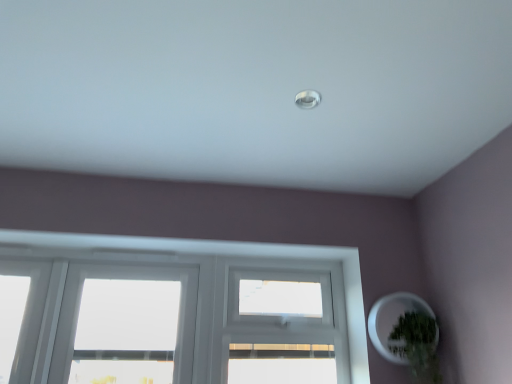
I want to click on white matte plant pot at lower right, so click(x=393, y=322).

What is the approximate width of white matte plant pot at lower right?

white matte plant pot at lower right is 10.65 centimeters in width.

What do you see at coordinates (393, 322) in the screenshot?
I see `white matte plant pot at lower right` at bounding box center [393, 322].

What do you see at coordinates (417, 345) in the screenshot?
I see `green matte plant at lower right` at bounding box center [417, 345].

In the scene shown: Measure the distance between green matte plant at lower right and camera.

green matte plant at lower right is 1.87 meters from camera.

Identify the location of green matte plant at lower right. The image size is (512, 384). (417, 345).

In order to click on white matte plant pot at lower right in this screenshot , I will do `click(393, 322)`.

Between white matte plant pot at lower right and green matte plant at lower right, which one appears on the right side from the viewer's perspective?

Positioned to the right is green matte plant at lower right.

Which object is more forward, white matte plant pot at lower right or green matte plant at lower right?

green matte plant at lower right.

In the scene shown: Which is nearer, (376,311) or (401,355)?

Point (376,311).

From the image's perspective, is white matte plant pot at lower right above or below green matte plant at lower right?

Clearly, from the image's perspective, white matte plant pot at lower right is above green matte plant at lower right.

From a real-world perspective, is white matte plant pot at lower right over green matte plant at lower right?

Indeed, from a real-world perspective, white matte plant pot at lower right stands above green matte plant at lower right.

Is white matte plant pot at lower right wider or thinner than green matte plant at lower right?

In the image, white matte plant pot at lower right appears to be more narrow than green matte plant at lower right.

Which of these two, white matte plant pot at lower right or green matte plant at lower right, stands shorter?

Standing shorter between the two is white matte plant pot at lower right.

Considering the relative sizes of white matte plant pot at lower right and green matte plant at lower right in the image provided, is white matte plant pot at lower right smaller than green matte plant at lower right?

Incorrect, white matte plant pot at lower right is not smaller in size than green matte plant at lower right.

Which is correct: white matte plant pot at lower right is inside green matte plant at lower right, or outside of it?

white matte plant pot at lower right is enclosed within green matte plant at lower right.

Is white matte plant pot at lower right beside green matte plant at lower right?

Yes, the surface of white matte plant pot at lower right is in contact with green matte plant at lower right.

Is green matte plant at lower right at the back of white matte plant pot at lower right?

Yes, white matte plant pot at lower right is facing away from green matte plant at lower right.

Can you tell me how much white matte plant pot at lower right and green matte plant at lower right differ in facing direction?

The facing directions of white matte plant pot at lower right and green matte plant at lower right are 0.000546 degrees apart.

The height and width of the screenshot is (384, 512). I want to click on houseplant on the right of white matte plant pot at lower right, so click(417, 345).

Considering the positions of objects green matte plant at lower right and white matte plant pot at lower right in the image provided, who is more to the left, green matte plant at lower right or white matte plant pot at lower right?

From the viewer's perspective, white matte plant pot at lower right appears more on the left side.

Consider the image. Relative to white matte plant pot at lower right, is green matte plant at lower right in front or behind?

green matte plant at lower right is positioned closer to the viewer than white matte plant pot at lower right.

Does point (422, 344) appear closer or farther from the camera than point (437, 345)?

Point (422, 344) appears to be closer to the viewer than point (437, 345).

From the image's perspective, which object appears higher, green matte plant at lower right or white matte plant pot at lower right?

white matte plant pot at lower right, from the image's perspective.

From a real-world perspective, is green matte plant at lower right beneath white matte plant pot at lower right?

Yes.

Considering the relative sizes of green matte plant at lower right and white matte plant pot at lower right in the image provided, is green matte plant at lower right thinner than white matte plant pot at lower right?

Incorrect, the width of green matte plant at lower right is not less than that of white matte plant pot at lower right.

Who is taller, green matte plant at lower right or white matte plant pot at lower right?

Standing taller between the two is green matte plant at lower right.

Looking at the image, does green matte plant at lower right seem bigger or smaller compared to white matte plant pot at lower right?

Clearly, green matte plant at lower right is smaller in size than white matte plant pot at lower right.

Is green matte plant at lower right positioned beyond the bounds of white matte plant pot at lower right?

No, green matte plant at lower right is inside white matte plant pot at lower right's boundary.

Is green matte plant at lower right far from white matte plant pot at lower right?

No.

Is white matte plant pot at lower right at the back of green matte plant at lower right?

Result: Correct, green matte plant at lower right is looking away from white matte plant pot at lower right.

How much distance is there between green matte plant at lower right and white matte plant pot at lower right?

6.73 centimeters.

Locate an element on the screen. houseplant that appears below the white matte plant pot at lower right (from a real-world perspective) is located at coordinates (417, 345).

Locate an element on the screen. oval above the green matte plant at lower right (from a real-world perspective) is located at coordinates (393, 322).

Find the location of a particular element. The width and height of the screenshot is (512, 384). oval above the green matte plant at lower right (from the image's perspective) is located at coordinates (393, 322).